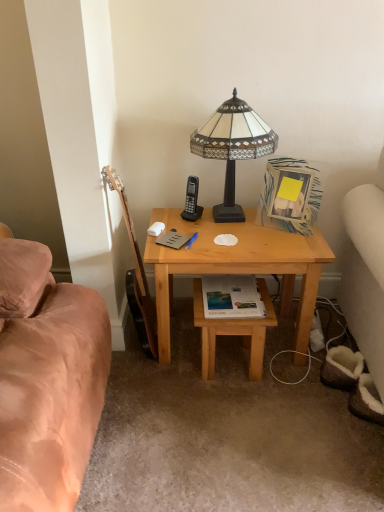
Locate an element on the screen. This screenshot has width=384, height=512. vacant region to the left of black plastic phone at center is located at coordinates (171, 217).